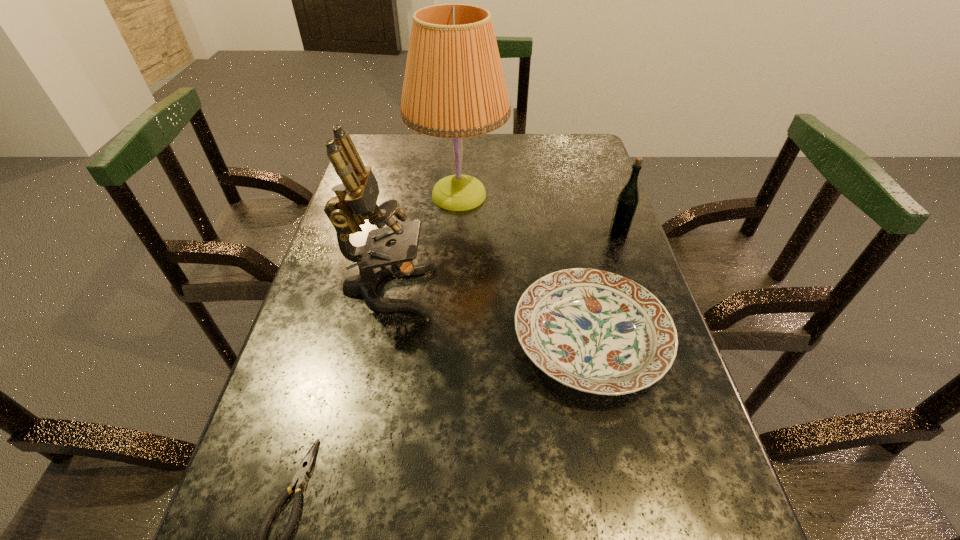
Locate an element on the screen. the farthest object is located at coordinates (454, 87).

Where is `lamp`? lamp is located at coordinates (454, 87).

Locate an element on the screen. This screenshot has height=540, width=960. microscope is located at coordinates (356, 197).

This screenshot has width=960, height=540. Identify the location of the third shortest object. (626, 204).

Where is `beer bottle`? Image resolution: width=960 pixels, height=540 pixels. beer bottle is located at coordinates (626, 204).

You are a GUI agent. You are given a task and a screenshot of the screen. Output one action in this format:
    pyautogui.click(x=<x>, y=<y>)
    Task: Click on the second shortest object
    The height and width of the screenshot is (540, 960).
    Given the screenshot: What is the action you would take?
    pyautogui.click(x=598, y=332)

Where is `free space located on the side of the farthest object near the pull switch`? The height and width of the screenshot is (540, 960). free space located on the side of the farthest object near the pull switch is located at coordinates (550, 195).

Locate an element on the screen. Image resolution: width=960 pixels, height=540 pixels. vacant region located at the eyepieces of the microscope is located at coordinates (563, 290).

Locate an element on the screen. The image size is (960, 540). free space located 0.360m on the back of the second farthest object is located at coordinates (592, 155).

Locate an element on the screen. The width and height of the screenshot is (960, 540). free location located 0.330m on the back of the plate is located at coordinates (560, 200).